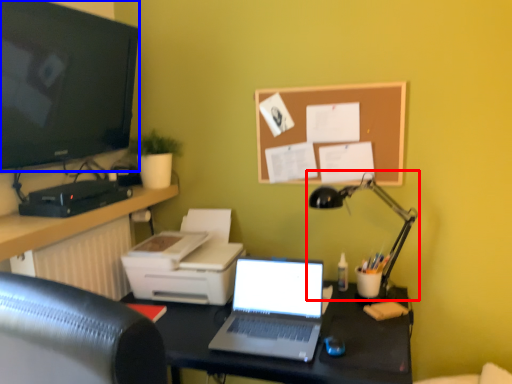
Question: Which object is further to the camera taking this photo, lamp (highlighted by a red box) or television (highlighted by a blue box)?

Choices:
 (A) lamp
 (B) television

Answer: (A)